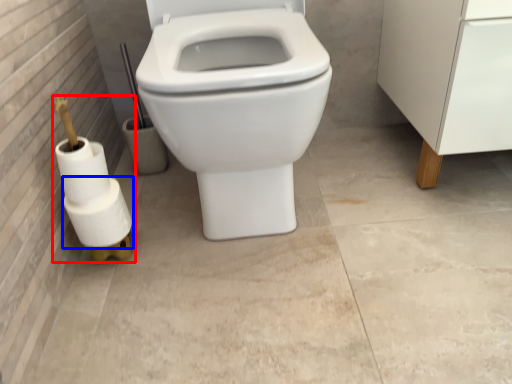
Question: Among these objects, which one is nearest to the camera, toilet paper (highlighted by a red box) or toilet paper (highlighted by a blue box)?

Choices:
 (A) toilet paper
 (B) toilet paper

Answer: (A)